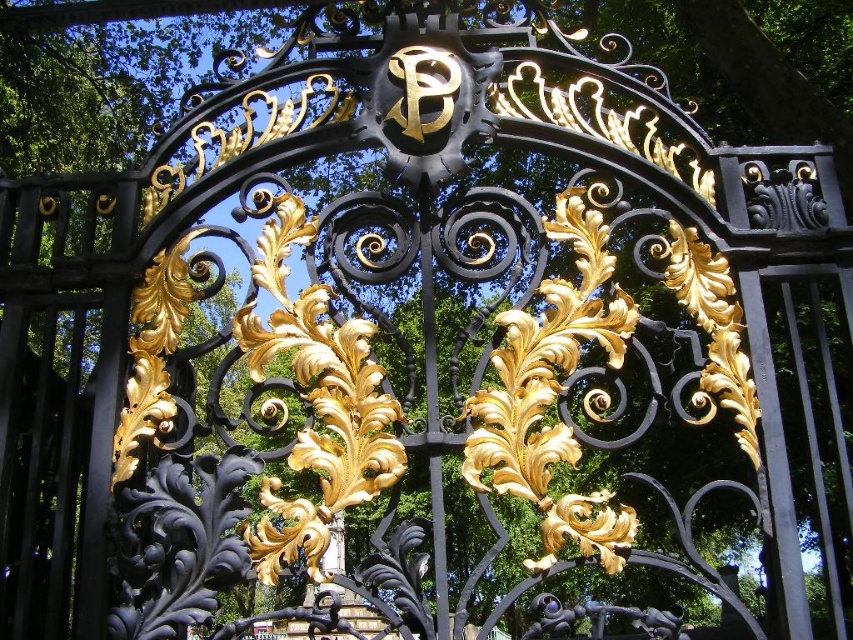
Question: From the image, what is the correct spatial relationship of gold leafy ornament at center in relation to gold leaf design at center?

Choices:
 (A) right
 (B) left

Answer: (B)

Question: Which of these objects is positioned farthest from the gold leaf design at center?

Choices:
 (A) glossy gold leaf at center
 (B) gold leafy ornament at center

Answer: (A)

Question: Can you confirm if gold leafy ornament at center is wider than gold leaf design at center?

Choices:
 (A) yes
 (B) no

Answer: (A)

Question: Can you confirm if gold leafy ornament at center is positioned above glossy gold leaf at center?

Choices:
 (A) no
 (B) yes

Answer: (B)

Question: Based on their relative distances, which object is farther from the gold leaf design at center?

Choices:
 (A) glossy gold leaf at center
 (B) gold leafy ornament at center

Answer: (A)

Question: Which object is the closest to the gold leaf design at center?

Choices:
 (A) gold leafy ornament at center
 (B) glossy gold leaf at center

Answer: (A)